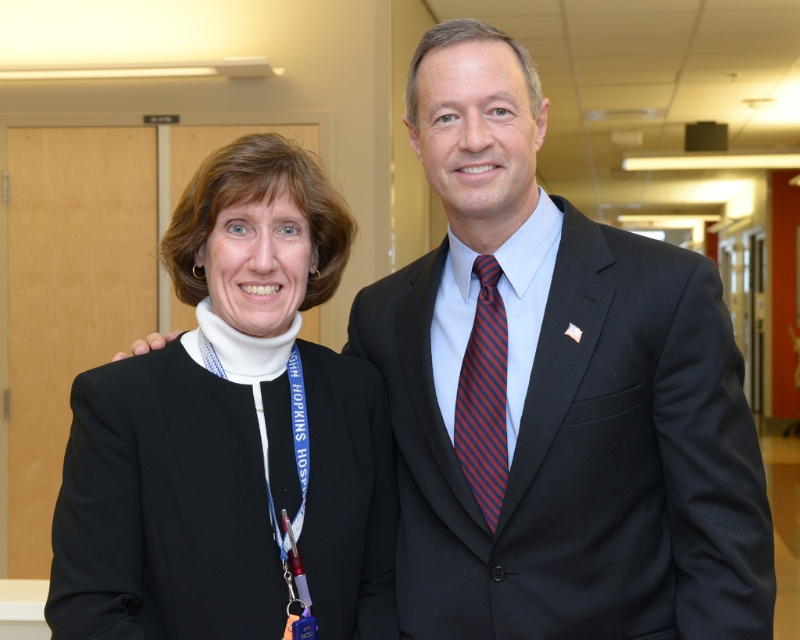
Question: Can you confirm if matte black suit at center is smaller than striped silk tie at center?

Choices:
 (A) no
 (B) yes

Answer: (A)

Question: Considering the real-world distances, which object is farthest from the matte black suit at center?

Choices:
 (A) striped silk tie at center
 (B) black woolen blazer at left

Answer: (B)

Question: Is black woolen blazer at left wider than striped silk tie at center?

Choices:
 (A) yes
 (B) no

Answer: (A)

Question: Based on their relative distances, which object is farther from the black woolen blazer at left?

Choices:
 (A) striped silk tie at center
 (B) matte black suit at center

Answer: (A)

Question: Does matte black suit at center come in front of striped silk tie at center?

Choices:
 (A) yes
 (B) no

Answer: (A)

Question: Which object is closer to the camera taking this photo?

Choices:
 (A) black woolen blazer at left
 (B) matte black suit at center

Answer: (A)